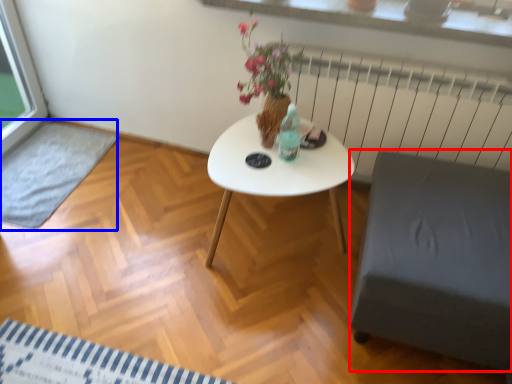
Question: Which point is closer to the camera, armchair (highlighted by a red box) or wide (highlighted by a blue box)?

Choices:
 (A) armchair
 (B) wide

Answer: (A)